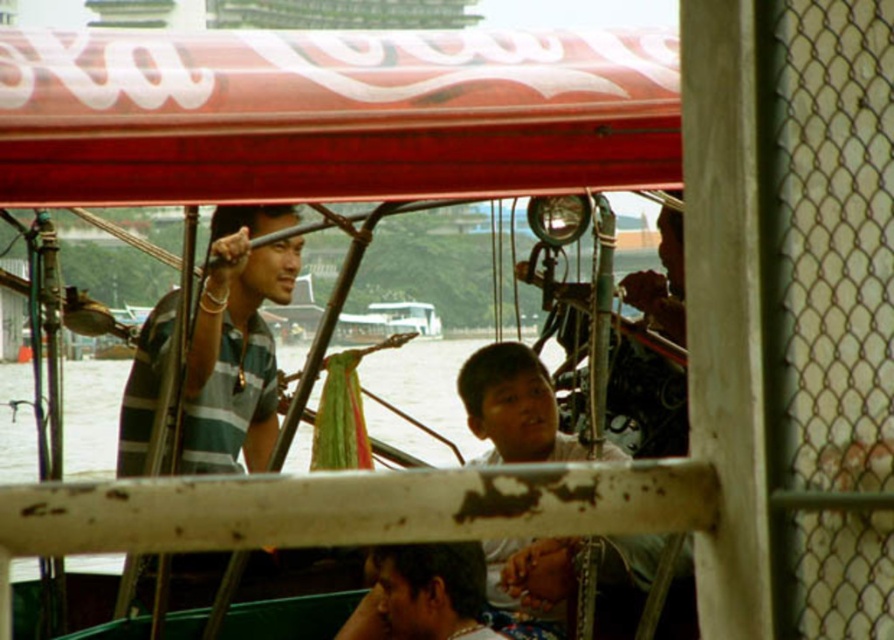
You are standing on the deck of the boat and want to hand an item to the person wearing the green striped shirt at center. Which direction should you move to ensure you are facing them while avoiding the clear water at lower left?

You should move to the right side of the deck to face the green striped shirt at center while avoiding the clear water at lower left, since the green striped shirt at center is to the right of the clear water at lower left.

Consider the image. You are standing on the deck of the boat and see the clear water at lower left and the dark brown skin at lower center. Which object is positioned to the left of the other?

The clear water at lower left is to the left of dark brown skin at lower center.

You are taking a photo from the front of the boat and want to focus on both the point at coordinates point (243, 404) and point (403, 385). Which point is closer to your camera?

Point (243, 404) is closer to the camera than point (403, 385).